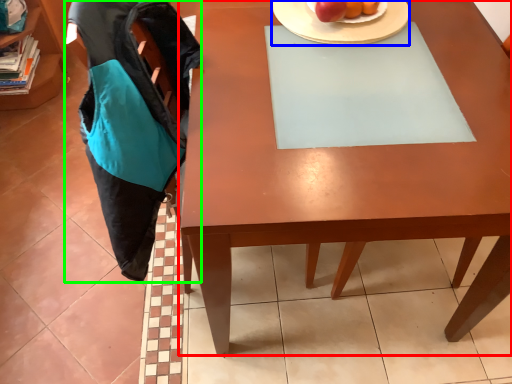
Question: Which object is positioned closest to desk (highlighted by a red box)? Select from plate (highlighted by a blue box) and swivel chair (highlighted by a green box).

Choices:
 (A) plate
 (B) swivel chair

Answer: (B)